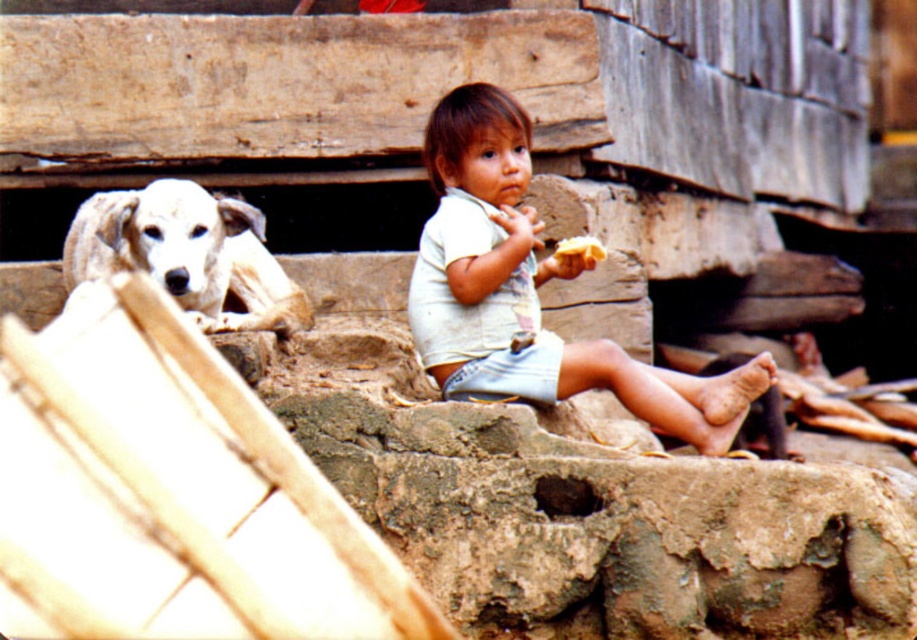
Who is lower down, white fur dog at left or yellow crumbly bread at center?

white fur dog at left is lower down.

Can you confirm if white fur dog at left is positioned to the right of yellow crumbly bread at center?

In fact, white fur dog at left is to the left of yellow crumbly bread at center.

Image resolution: width=917 pixels, height=640 pixels. What do you see at coordinates (186, 253) in the screenshot? I see `white fur dog at left` at bounding box center [186, 253].

The width and height of the screenshot is (917, 640). I want to click on white fur dog at left, so pyautogui.click(x=186, y=253).

Between point (467, 262) and point (569, 253), which one is positioned behind?

The point (569, 253) is behind.

Is light beige cotton shirt at center bigger than yellow crumbly bread at center?

Indeed, light beige cotton shirt at center has a larger size compared to yellow crumbly bread at center.

This screenshot has width=917, height=640. What do you see at coordinates (529, 291) in the screenshot?
I see `light beige cotton shirt at center` at bounding box center [529, 291].

Identify the location of light beige cotton shirt at center. (529, 291).

Is point (518, 396) farther from camera compared to point (175, 225)?

Yes.

What do you see at coordinates (529, 291) in the screenshot? The width and height of the screenshot is (917, 640). I see `light beige cotton shirt at center` at bounding box center [529, 291].

Which is in front, point (507, 301) or point (214, 308)?

Point (507, 301)

Locate an element on the screen. light beige cotton shirt at center is located at coordinates (529, 291).